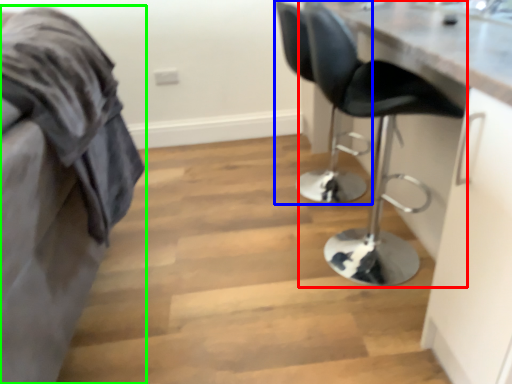
Question: Considering the real-world distances, which object is closest to chair (highlighted by a red box)? chair (highlighted by a blue box) or furniture (highlighted by a green box).

Choices:
 (A) chair
 (B) furniture

Answer: (B)